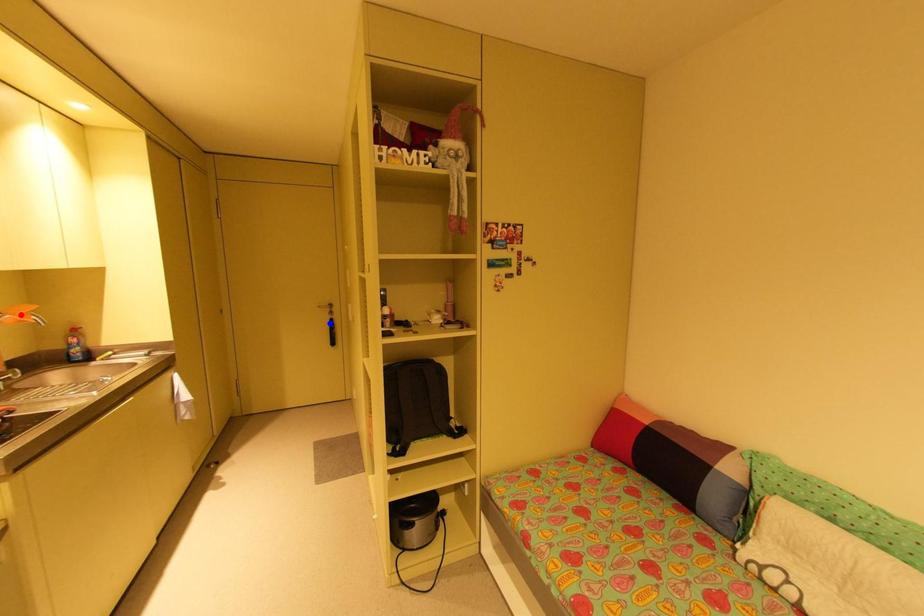
Question: Two points are marked on the image. Which point is closer to the camera?

Choices:
 (A) Blue point is closer.
 (B) Red point is closer.

Answer: (B)